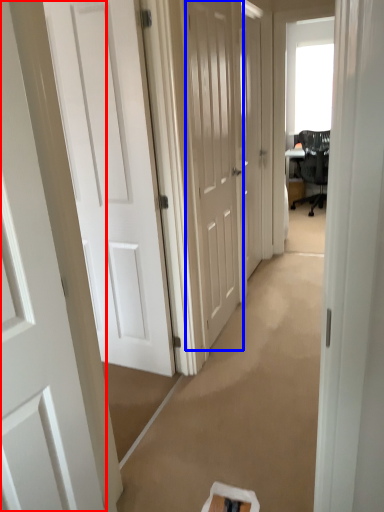
Question: Which of the following is the closest to the observer, door (highlighted by a red box) or door (highlighted by a blue box)?

Choices:
 (A) door
 (B) door

Answer: (A)